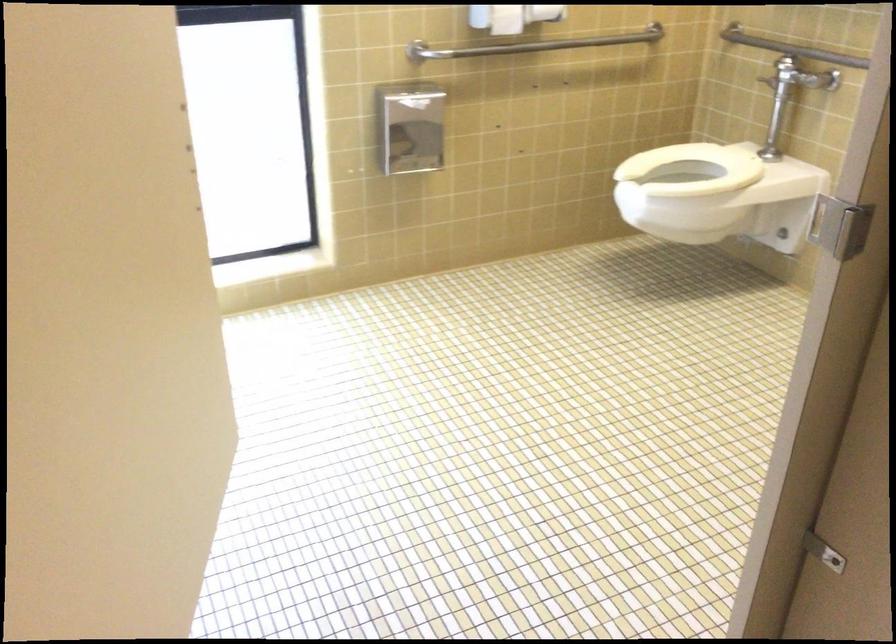
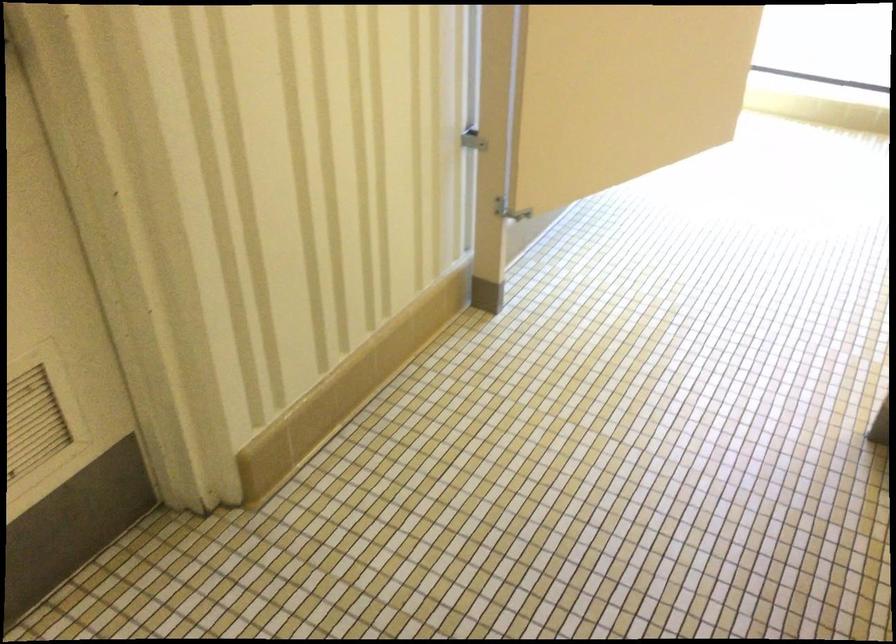
Find the pixel in the second image that matches (156,529) in the first image.

(623, 91)